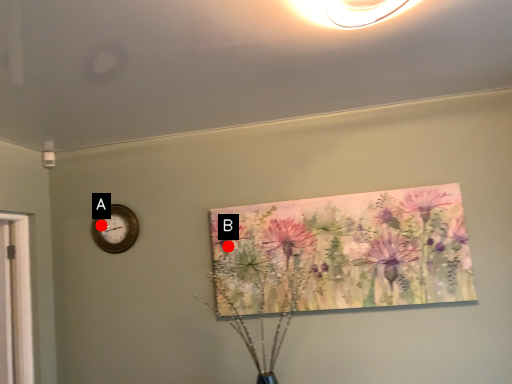
Question: Two points are circled on the image, labeled by A and B beside each circle. Which point is closer to the camera?

Choices:
 (A) A is closer
 (B) B is closer

Answer: (B)